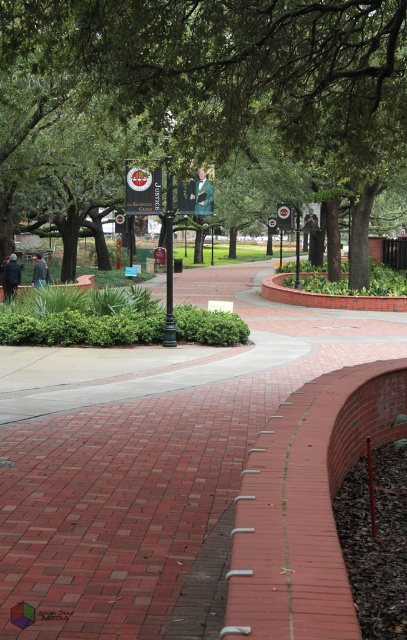
Describe the element at coordinates (148, 458) in the screenshot. The image size is (407, 640). I see `red brick pathway at center` at that location.

Based on the photo, does red brick pathway at center have a greater height compared to green leafy tree at center?

In fact, red brick pathway at center may be shorter than green leafy tree at center.

Which is behind, point (46, 509) or point (70, 45)?

The point (70, 45) is more distant.

At what (x,y) coordinates should I click in order to perform the action: click on red brick pathway at center. Please return your answer as a coordinate pair (x, y). The width and height of the screenshot is (407, 640). Looking at the image, I should click on (148, 458).